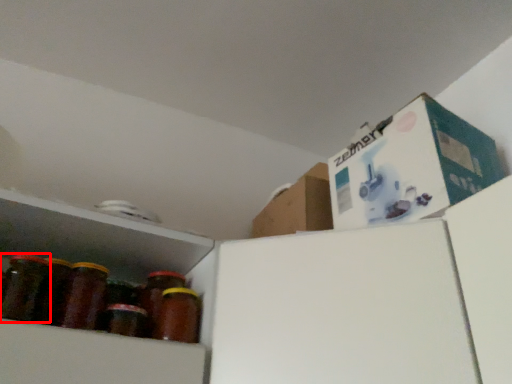
Question: From the image's perspective, considering the relative positions of bottle (annotated by the red box) and bottle in the image provided, where is bottle (annotated by the red box) located with respect to the staircase?

Choices:
 (A) below
 (B) above

Answer: (B)